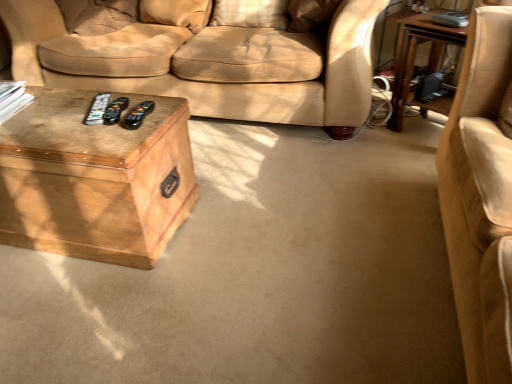
Locate an element on the screen. free spot to the right of wooden trunk at lower left, acting as the first table starting from the left is located at coordinates (245, 212).